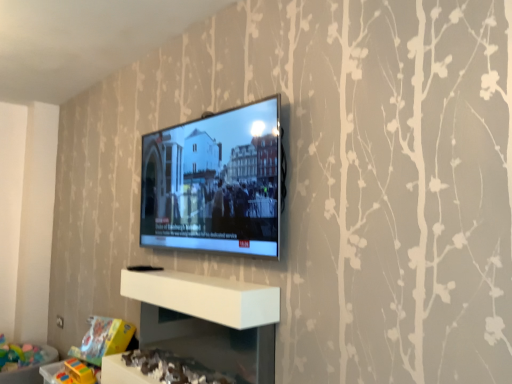
What are the coordinates of `vacant space underneath matte black tv at center (from a real-world perspective)` in the screenshot? It's located at (208, 274).